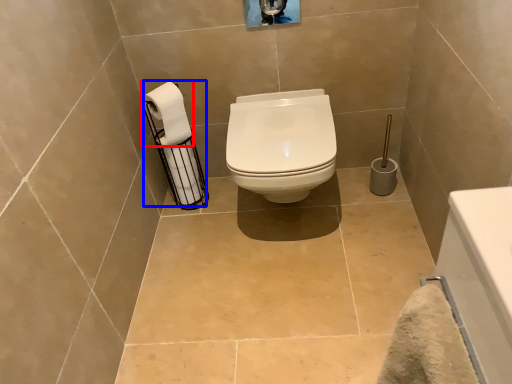
Question: Which object appears farthest to the camera in this image, toilet paper (highlighted by a red box) or toilet paper (highlighted by a blue box)?

Choices:
 (A) toilet paper
 (B) toilet paper

Answer: (B)